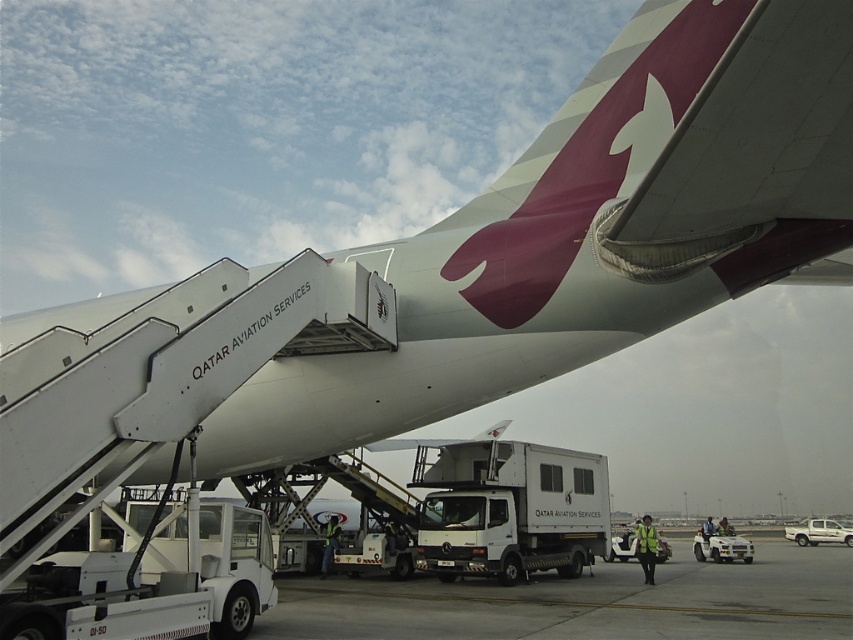
You are a ground crew member at the airport and need to move the white matte truck at lower right to make space for an incoming vehicle. Which direction should you move it so that it doesn not block the white matte truck at center?

You should move the white matte truck at lower right to the right side, as it is currently positioned to the right of the white matte truck at center. Moving it further to the right will keep it out of the way without obstructing the white matte truck at center.